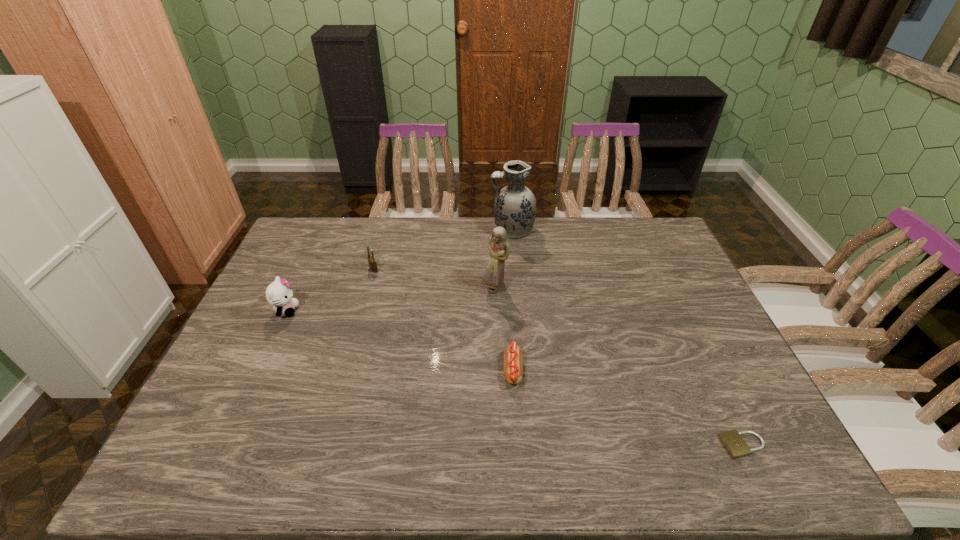
This screenshot has height=540, width=960. I want to click on vacant area that lies between the farthest object and the fifth nearest object, so click(443, 249).

The image size is (960, 540). Identify the location of free point between the third farthest object and the leftmost object. (391, 300).

The image size is (960, 540). What are the coordinates of `vacant space in between the nearest object and the fifth object from right to left` in the screenshot? It's located at (558, 357).

The image size is (960, 540). Find the location of `free space that is in between the fifth object from right to left and the vase`. free space that is in between the fifth object from right to left and the vase is located at coordinates (443, 249).

What are the coordinates of `free space between the figurine and the second nearest object` in the screenshot? It's located at (504, 330).

Find the location of a particular element. Image resolution: width=960 pixels, height=540 pixels. vacant space that's between the farther padlock and the shorter padlock is located at coordinates (558, 357).

This screenshot has height=540, width=960. I want to click on object identified as the third closest to the fifth tallest object, so click(515, 205).

This screenshot has width=960, height=540. Identify the location of the second closest object to the third nearest object. (498, 248).

In order to click on free space that satisfies the following two spatial constraints: 1. on the front-facing side of the fourth farthest object; 2. on the back side of the nearer padlock in this screenshot , I will do `click(224, 445)`.